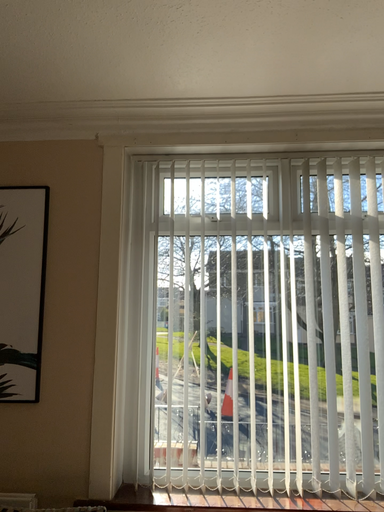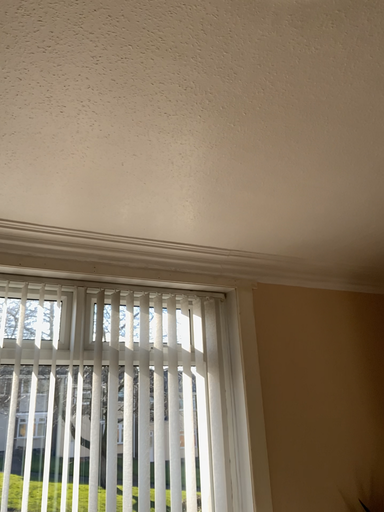
Question: How did the camera likely rotate when shooting the video?

Choices:
 (A) rotated right
 (B) rotated left

Answer: (A)